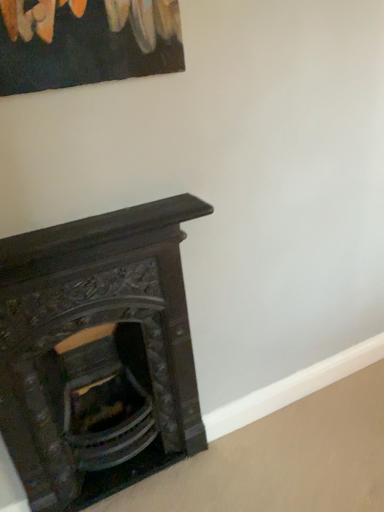
Where is `dark wood fireplace at lower left`? dark wood fireplace at lower left is located at coordinates (98, 353).

Image resolution: width=384 pixels, height=512 pixels. Describe the element at coordinates (98, 353) in the screenshot. I see `dark wood fireplace at lower left` at that location.

At what (x,y) coordinates should I click in order to perform the action: click on dark wood fireplace at lower left. Please return your answer as a coordinate pair (x, y). Looking at the image, I should click on (98, 353).